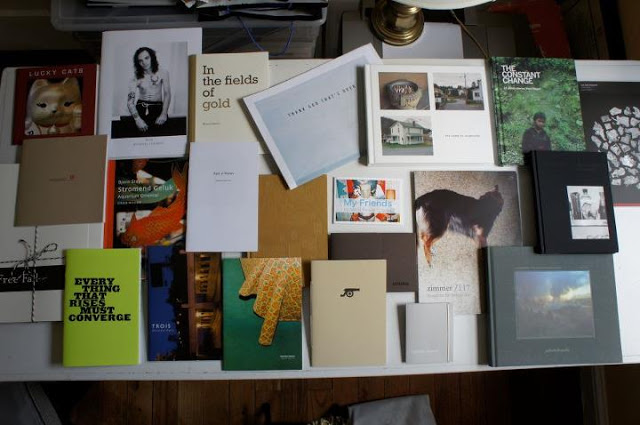
Locate an element on the screen. This screenshot has width=640, height=425. book is located at coordinates (52, 115).